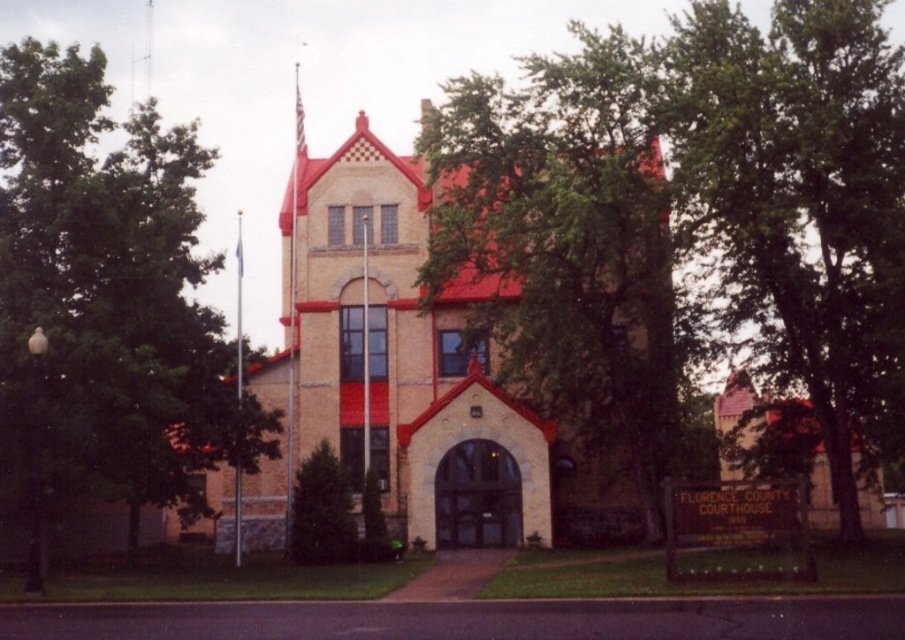
Is green leafy tree at left behind green textured evergreen tree at center?

No, green leafy tree at left is closer to the viewer.

Looking at this image, can you confirm if green leafy tree at left is bigger than green textured evergreen tree at center?

Correct, green leafy tree at left is larger in size than green textured evergreen tree at center.

At what (x,y) coordinates should I click in order to perform the action: click on green leafy tree at left. Please return your answer as a coordinate pair (x, y). This screenshot has height=640, width=905. Looking at the image, I should click on (105, 304).

Who is more distant from viewer, (548, 92) or (122, 157)?

Positioned behind is point (548, 92).

Which is behind, point (437, 172) or point (110, 401)?

Point (437, 172)

Identify the location of green leafy tree at center. (691, 209).

Who is shorter, green leafy tree at left or beige stone church at center?

beige stone church at center

Which is in front, point (7, 212) or point (360, 113)?

Point (7, 212) is more forward.

Locate an element on the screen. The height and width of the screenshot is (640, 905). green leafy tree at left is located at coordinates (105, 304).